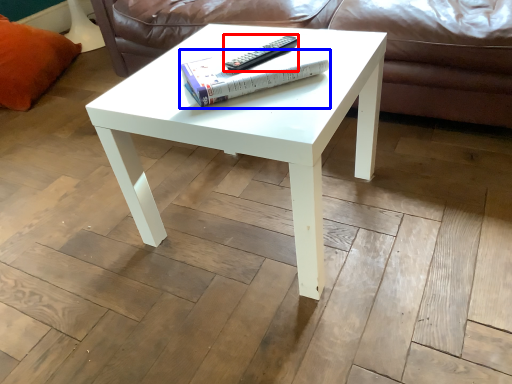
Question: Which object is closer to the camera taking this photo, remote (highlighted by a red box) or paperback book (highlighted by a blue box)?

Choices:
 (A) remote
 (B) paperback book

Answer: (B)